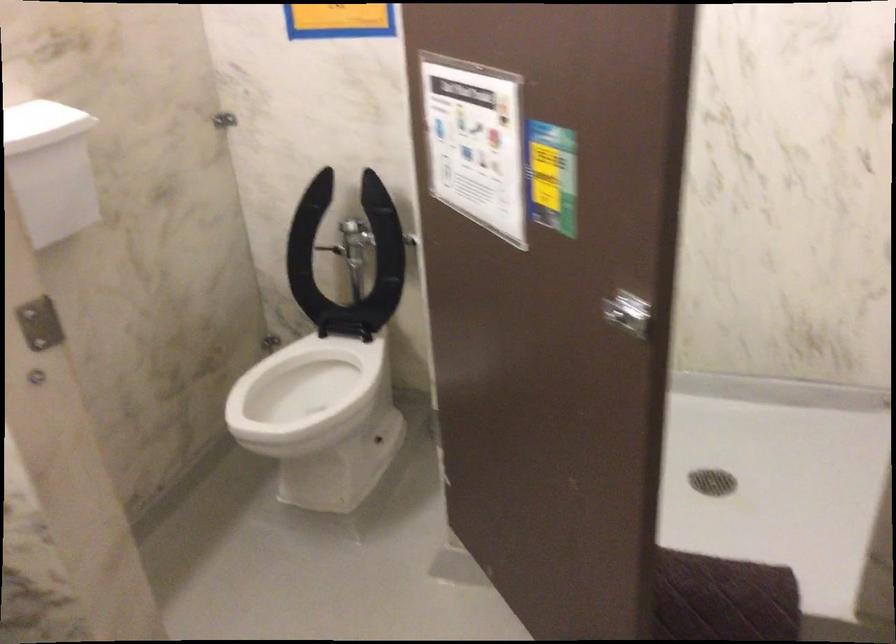
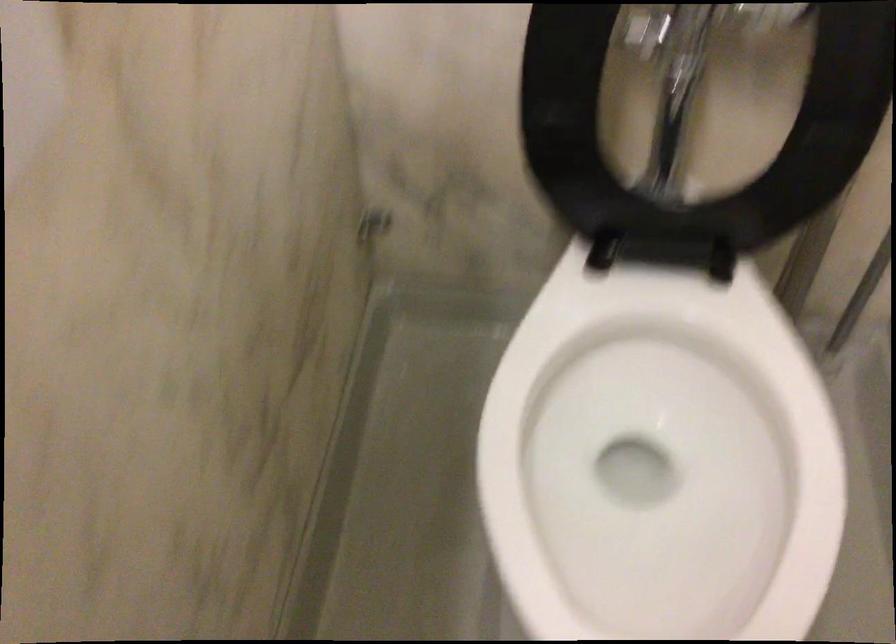
In a continuous first-person perspective shot, in which direction is the camera moving?

The cameraman moved toward left, forward.